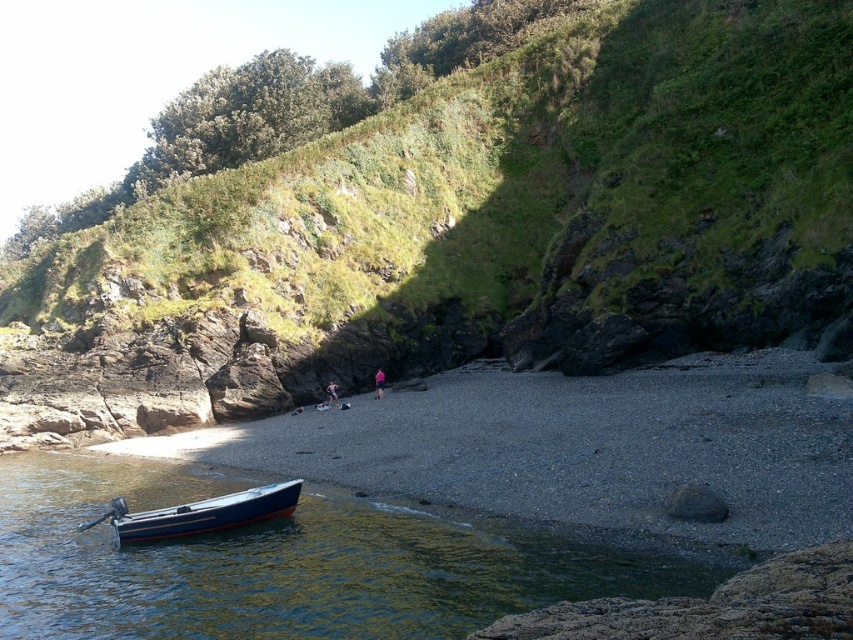
You are a photographer planning to capture the blue polished wood boat at lower left and the light pink fabric at center in your shot. Which object should you focus on first if you want to include both in your frame without adjusting your camera settings, considering their heights?

The blue polished wood boat at lower left has a lesser height compared to the light pink fabric at center, so you should focus on the light pink fabric at center first since it is taller and requires more attention in the frame.

You are a photographer standing on the beach. You want to capture a photo that includes both the rough textured rock at lower right and the blue polished wood boat at lower left. Given that your camera has a maximum focus range of 12 meters, will you be able to focus on both subjects simultaneously?

The rough textured rock at lower right is 12.46 meters away from the blue polished wood boat at lower left. Since the distance between them exceeds the camera maximum focus range of 12 meters, you cannot focus on both subjects simultaneously.

You are standing on the rocky beach in the image. You see a point marked at coordinates [379,384]. What object is located at that point?

The point at coordinates [379,384] indicates the pink fabric at center.